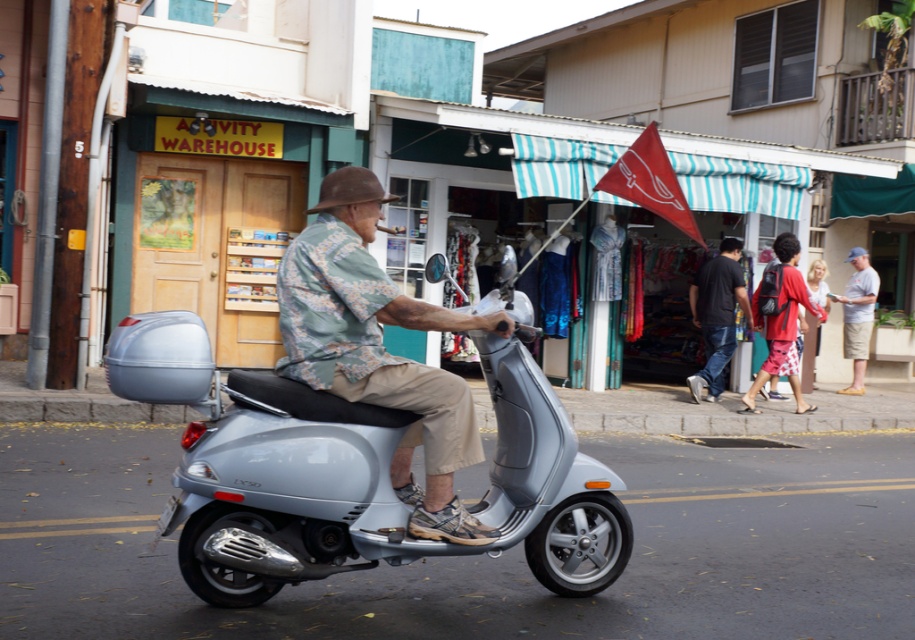
Question: Considering the relative positions of metallic silver scooter at center and reddish-pink fabric shorts at center-right in the image provided, where is metallic silver scooter at center located with respect to reddish-pink fabric shorts at center-right?

Choices:
 (A) left
 (B) right

Answer: (A)

Question: Which object is the farthest from the red fabric flag at center?

Choices:
 (A) metallic silver scooter at center
 (B) reddish-pink fabric shorts at center-right
 (C) dark blue jeans at center
 (D) camouflage shirt at center

Answer: (C)

Question: Is camouflage shirt at center above reddish-pink fabric shorts at center-right?

Choices:
 (A) yes
 (B) no

Answer: (B)

Question: Is camouflage shirt at center thinner than reddish-pink fabric shorts at center-right?

Choices:
 (A) yes
 (B) no

Answer: (A)

Question: Which of the following is the farthest from the observer?

Choices:
 (A) (634, 152)
 (B) (423, 301)

Answer: (B)

Question: Based on their relative distances, which object is nearer to the camouflage shirt at center?

Choices:
 (A) reddish-pink fabric shorts at center-right
 (B) dark blue jeans at center
 (C) red fabric flag at center

Answer: (C)